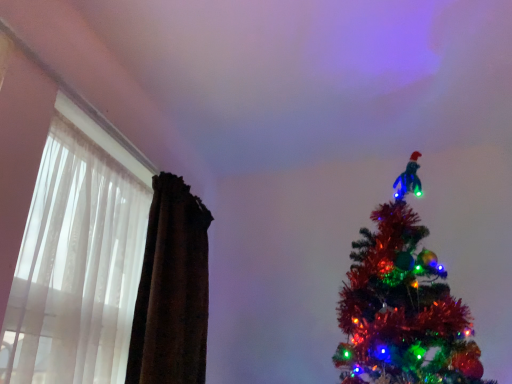
Question: Based on their sizes in the image, would you say brown velvet curtain at left is bigger or smaller than translucent fabric at left?

Choices:
 (A) big
 (B) small

Answer: (A)

Question: From a real-world perspective, is brown velvet curtain at left positioned above or below translucent fabric at left?

Choices:
 (A) above
 (B) below

Answer: (A)

Question: Is point (159, 178) positioned closer to the camera than point (112, 183)?

Choices:
 (A) closer
 (B) farther

Answer: (B)

Question: Is translucent fabric at left taller or shorter than brown velvet curtain at left?

Choices:
 (A) tall
 (B) short

Answer: (B)

Question: In terms of size, does translucent fabric at left appear bigger or smaller than brown velvet curtain at left?

Choices:
 (A) big
 (B) small

Answer: (B)

Question: Is translucent fabric at left inside the boundaries of brown velvet curtain at left, or outside?

Choices:
 (A) outside
 (B) inside

Answer: (A)

Question: Is translucent fabric at left wider or thinner than brown velvet curtain at left?

Choices:
 (A) thin
 (B) wide

Answer: (A)